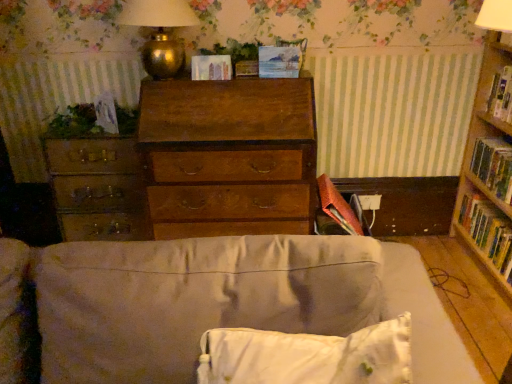
Question: Considering the positions of matte paper at center, placed as the 2th paperback book when sorted from bottom to top, and wooden chest of drawers at center in the image, is matte paper at center, placed as the 2th paperback book when sorted from bottom to top, bigger or smaller than wooden chest of drawers at center?

Choices:
 (A) small
 (B) big

Answer: (A)

Question: Is matte paper at center, positioned as the 3th paperback book in right-to-left order, wider or thinner than wooden chest of drawers at center?

Choices:
 (A) thin
 (B) wide

Answer: (A)

Question: Estimate the real-world distances between objects in this image. Which object is closer to the matte paper at center, the second paperback book when ordered from top to bottom?

Choices:
 (A) hardcover book at right
 (B) gold metallic table lamp at upper center
 (C) wooden chest of drawers at center
 (D) green leafy plant at center, which is the 1th plant from right to left
 (E) beige fabric couch at center

Answer: (D)

Question: Based on their relative distances, which object is farther from the matte paper at center, the first paperback book positioned from the left?

Choices:
 (A) beige fabric couch at center
 (B) hardcover book at right, positioned as the 1th paperback book in right-to-left order
 (C) wooden chest of drawers at center
 (D) gold metallic table lamp at upper center
 (E) white soft pillow at lower center

Answer: (E)